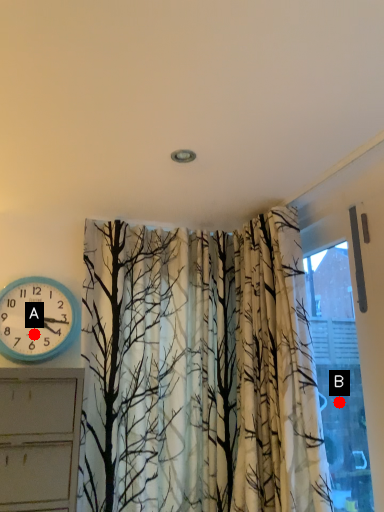
Question: Two points are circled on the image, labeled by A and B beside each circle. Which point is closer to the camera taking this photo?

Choices:
 (A) A is closer
 (B) B is closer

Answer: (A)